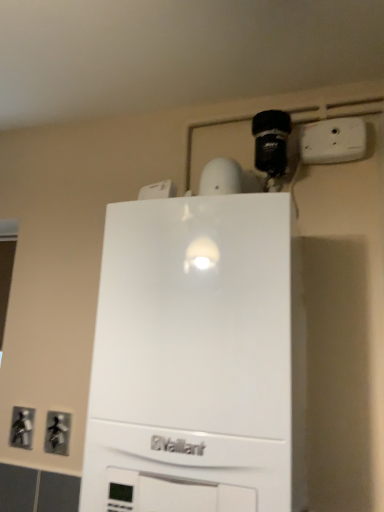
Question: Is metallic gray outlet at lower left, acting as the second electric outlet starting from the left, in front of or behind metallic silver outlet at lower left, the 3th electric outlet from the right, in the image?

Choices:
 (A) front
 (B) behind

Answer: (A)

Question: Is point (66, 424) positioned closer to the camera than point (13, 430)?

Choices:
 (A) farther
 (B) closer

Answer: (B)

Question: Which object is the farthest from the white plastic electric outlet at upper center, arranged as the 1th electric outlet when viewed from the top?

Choices:
 (A) white matte vaillant boiler at center
 (B) metallic gray outlet at lower left, which appears as the 2th electric outlet when viewed from the front
 (C) metallic silver outlet at lower left, positioned as the first electric outlet in left-to-right order

Answer: (C)

Question: Which object is positioned closest to the metallic silver outlet at lower left, the third electric outlet in the front-to-back sequence?

Choices:
 (A) white matte vaillant boiler at center
 (B) white plastic electric outlet at upper center, the 1th electric outlet positioned from the right
 (C) metallic gray outlet at lower left, which is counted as the second electric outlet, starting from the top

Answer: (C)